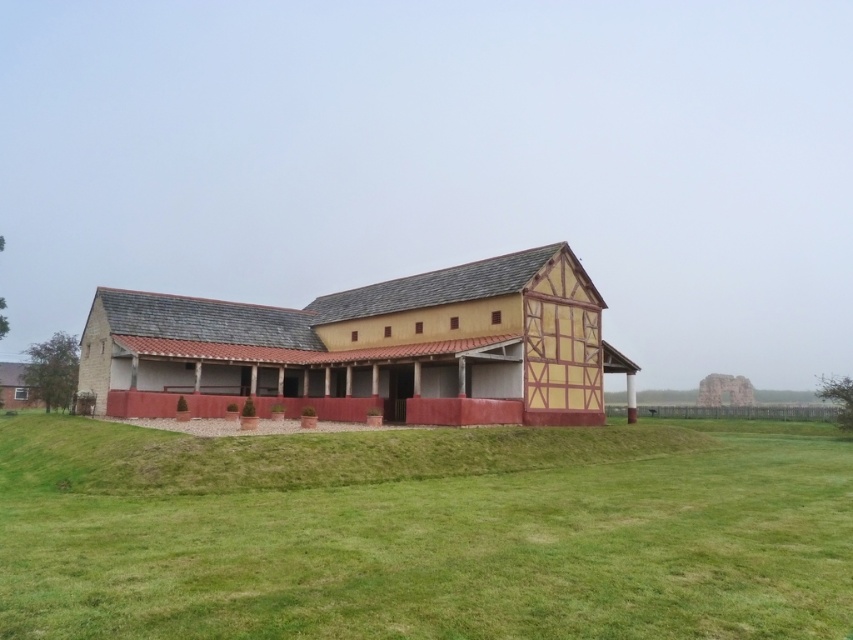
You are standing in the field and see the green grass at center and the wooden barn at center. Which one is closer to the ground?

The green grass at center is located below the wooden barn at center, so it is closer to the ground.

You are standing in front of the building and want to walk towards the wooden barn at center. Which direction should you go to avoid stepping on the green grass at center?

The green grass at center is closer to the viewer than the wooden barn at center, so to avoid stepping on the green grass at center, you should walk around it to the side, either left or right, towards the wooden barn at center.

You are standing in front of the building and see two points marked on the ground. The first point is at coordinates point [219,600] and the second point is at point [244,340]. Which point is closer to the entrance of the building?

Point [219,600] is in front of point [244,340], so it is closer to the entrance of the building.